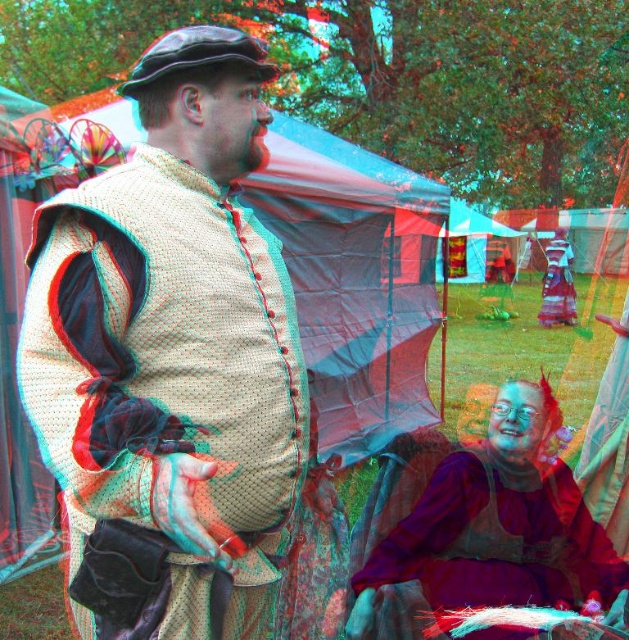
Question: Is matte beige vest at center to the right of matte purple dress at lower right from the viewer's perspective?

Choices:
 (A) yes
 (B) no

Answer: (B)

Question: Among these objects, which one is nearest to the camera?

Choices:
 (A) purple velvet dress at lower right
 (B) blue tarpaulin tent at center
 (C) matte purple dress at lower right
 (D) matte beige vest at center

Answer: (D)

Question: Observing the image, what is the correct spatial positioning of purple velvet dress at lower right in reference to blue tarpaulin tent at center?

Choices:
 (A) right
 (B) left

Answer: (B)

Question: Which point is farther to the camera?

Choices:
 (A) matte beige vest at center
 (B) blue tarpaulin tent at center
 (C) purple velvet dress at lower right

Answer: (B)

Question: Does matte beige vest at center lie in front of purple velvet dress at lower right?

Choices:
 (A) yes
 (B) no

Answer: (A)

Question: Which object is farther from the camera taking this photo?

Choices:
 (A) blue tarpaulin tent at center
 (B) purple velvet dress at lower right

Answer: (A)